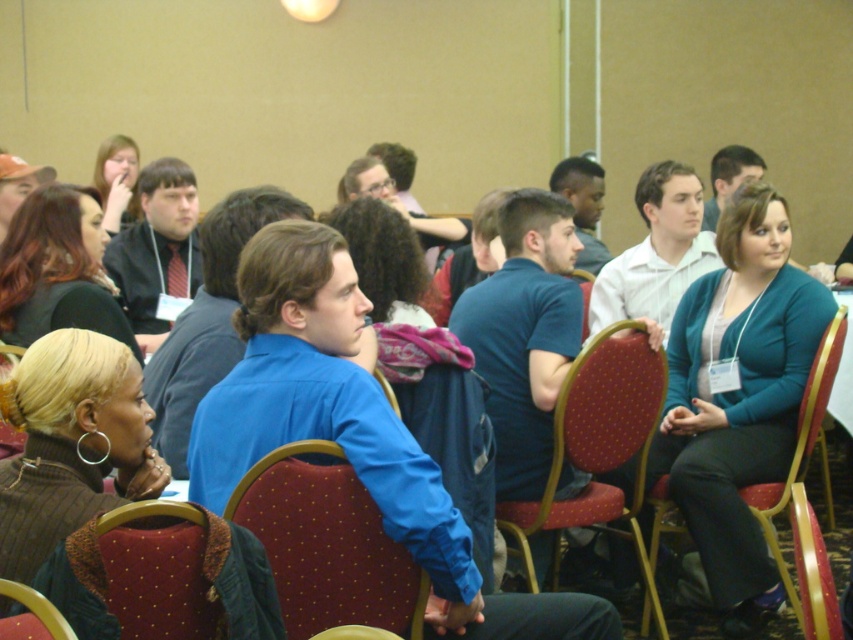
Question: Is polka dot fabric chair at center above velvet red chair at lower left?

Choices:
 (A) yes
 (B) no

Answer: (A)

Question: Which point is closer to the camera?

Choices:
 (A) velvet-like red chair at right
 (B) matte black jacket at upper left
 (C) polka dot fabric chair at center

Answer: (C)

Question: Does matte black hair at upper left come behind maroon fabric chair at lower left?

Choices:
 (A) no
 (B) yes

Answer: (B)

Question: Can you confirm if maroon fabric chair at center is positioned to the left of polka dot fabric chair at center?

Choices:
 (A) yes
 (B) no

Answer: (A)

Question: Which of the following is the closest to the observer?

Choices:
 (A) polka dot fabric chair at center
 (B) maroon fabric chair at center
 (C) maroon fabric chair at lower left

Answer: (C)

Question: Which of the following is the farthest from the observer?

Choices:
 (A) matte black jacket at upper left
 (B) maroon fabric chair at lower left

Answer: (A)